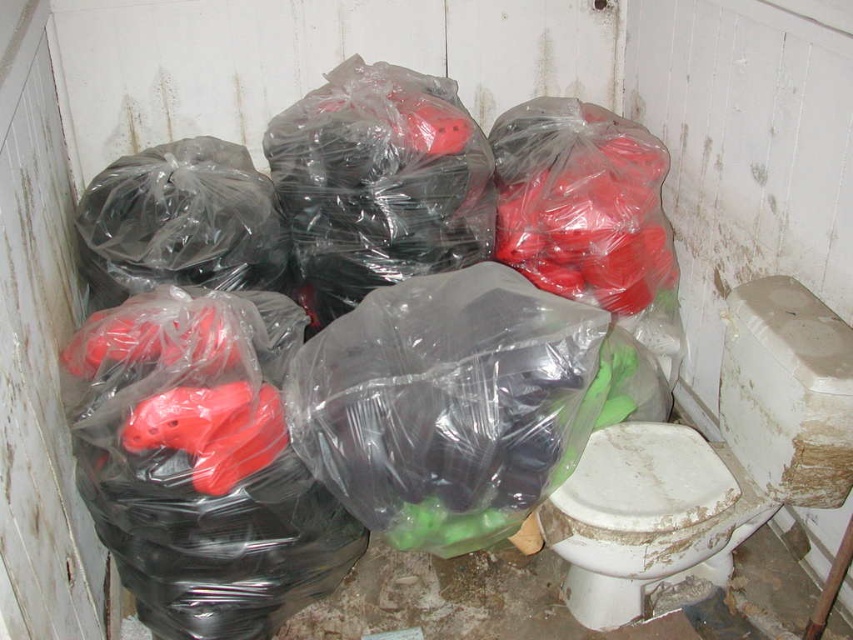
Question: Which point is farther to the camera?

Choices:
 (A) white glossy toilet bowl at lower right
 (B) translucent plastic bags at center

Answer: (A)

Question: Which of the following is the farthest from the observer?

Choices:
 (A) (735, 301)
 (B) (148, 483)

Answer: (A)

Question: Is translucent plastic bags at center in front of white glossy toilet bowl at lower right?

Choices:
 (A) yes
 (B) no

Answer: (A)

Question: Does translucent plastic bags at center have a larger size compared to white glossy toilet bowl at lower right?

Choices:
 (A) no
 (B) yes

Answer: (B)

Question: Does translucent plastic bags at center appear over white glossy toilet bowl at lower right?

Choices:
 (A) yes
 (B) no

Answer: (A)